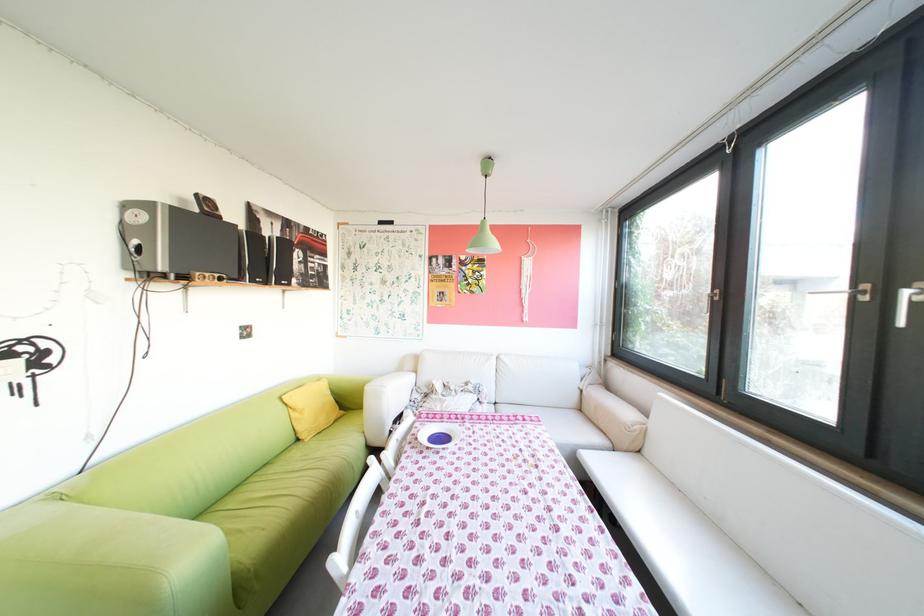
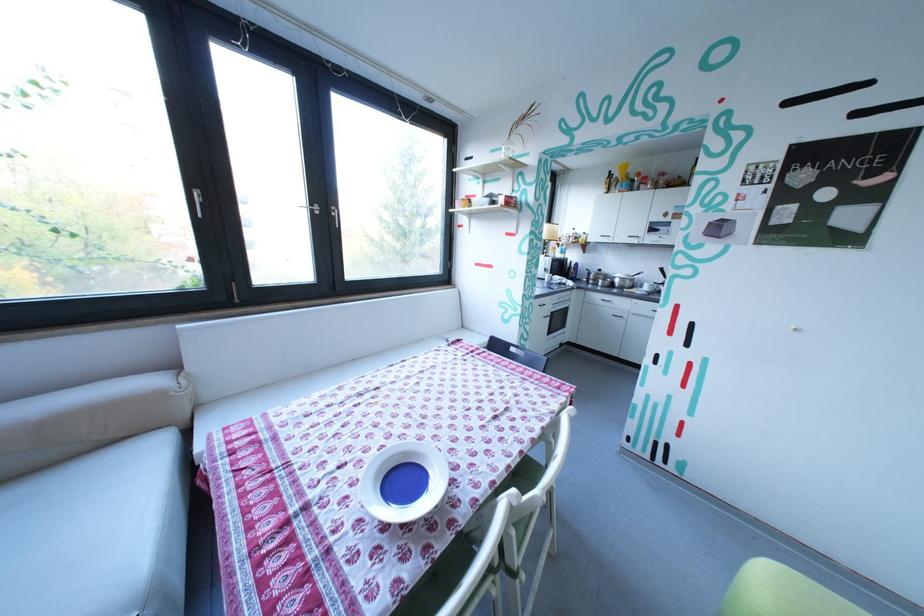
In the second image, find the point that corresponds to pixel 878 299 in the first image.

(331, 213)